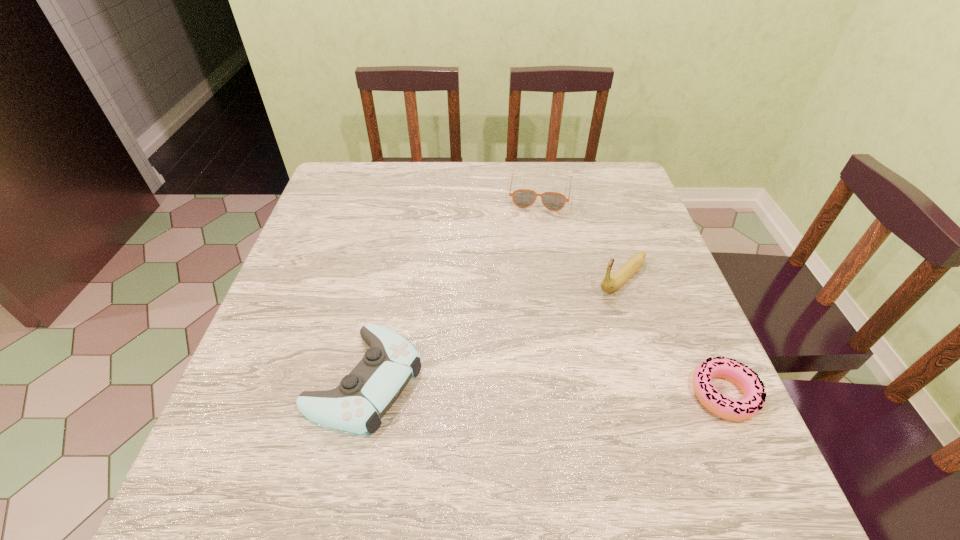
Find the location of a particular element. Image resolution: width=960 pixels, height=540 pixels. free space on the desktop that is between the control and the shortest object and is positioned on the front-facing side of the sunglasses is located at coordinates (514, 386).

Identify the location of vacant spot on the desktop that is between the leftmost object and the doughnut and is positioned at the stem of the second farthest object. The width and height of the screenshot is (960, 540). 504,386.